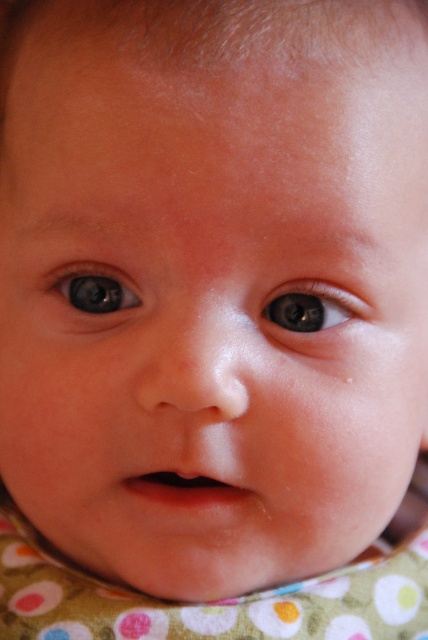
Question: Which point is farther to the camera?

Choices:
 (A) brown glossy eye at center
 (B) blue glossy eye at center

Answer: (B)

Question: Can you confirm if brown glossy eye at center is positioned to the left of blue glossy eye at center?

Choices:
 (A) no
 (B) yes

Answer: (A)

Question: Does brown glossy eye at center have a larger size compared to blue glossy eye at center?

Choices:
 (A) no
 (B) yes

Answer: (A)

Question: Which point is farther to the camera?

Choices:
 (A) blue glossy eye at center
 (B) brown glossy eye at center

Answer: (A)

Question: Does brown glossy eye at center appear on the left side of blue glossy eye at center?

Choices:
 (A) yes
 (B) no

Answer: (B)